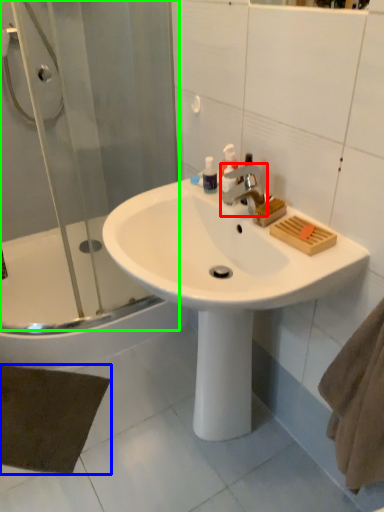
Question: Which object is positioned closest to tap (highlighted by a red box)? Select from bath mat (highlighted by a blue box) and shower door (highlighted by a green box).

Choices:
 (A) bath mat
 (B) shower door

Answer: (B)